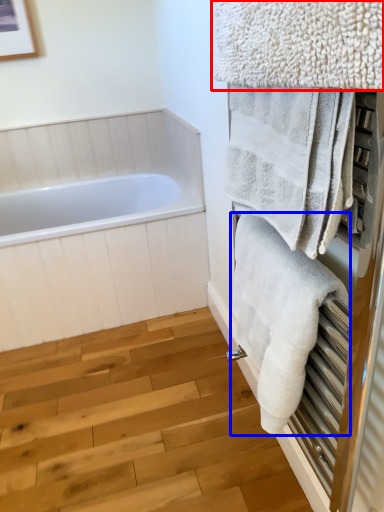
Question: Which of the following is the farthest to the observer, towel (highlighted by a red box) or towel (highlighted by a blue box)?

Choices:
 (A) towel
 (B) towel

Answer: (B)